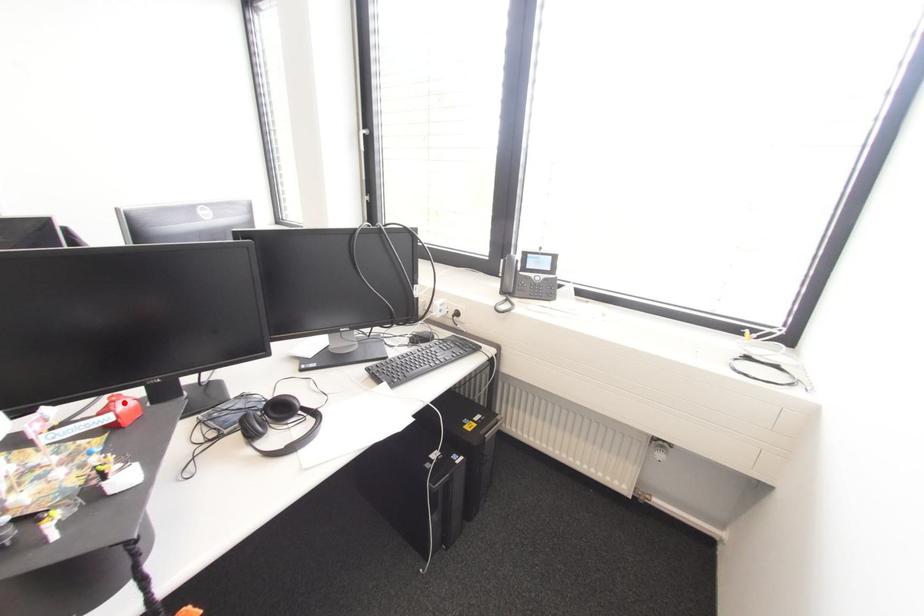
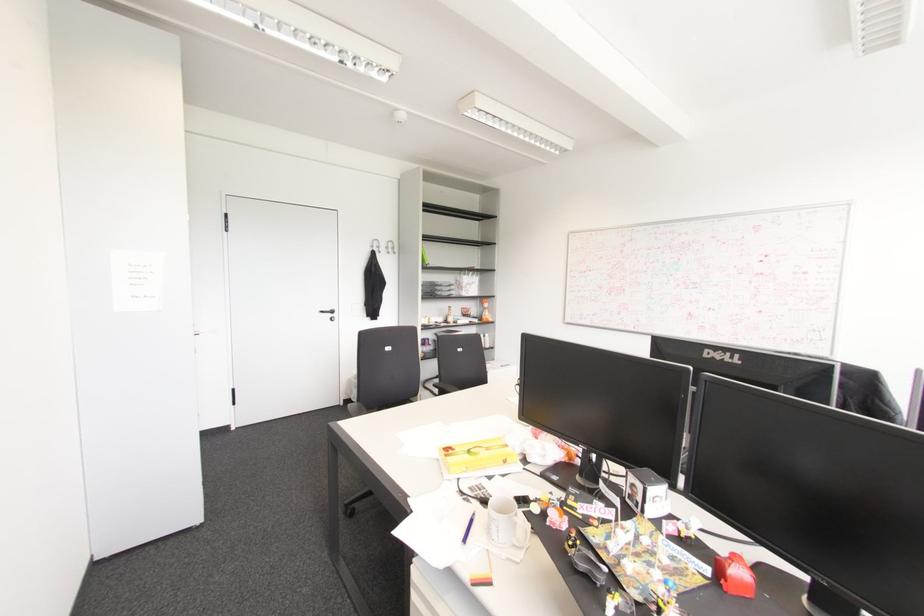
Question: I am providing you with two images of the same scene from different viewpoints. In image1, a red point is highlighted. Considering the same 3D point in image2, which of the following is correct?

Choices:
 (A) It is closer
 (B) It is farther

Answer: (A)